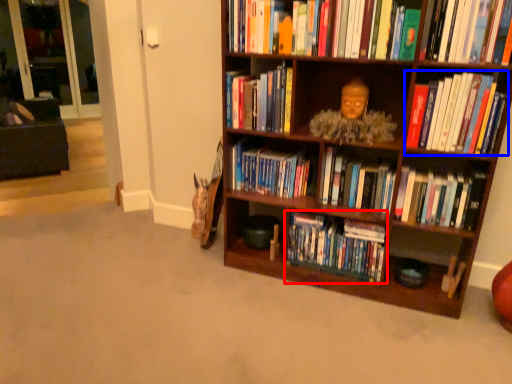
Question: Among these objects, which one is nearest to the camera, book (highlighted by a red box) or book (highlighted by a blue box)?

Choices:
 (A) book
 (B) book

Answer: (B)